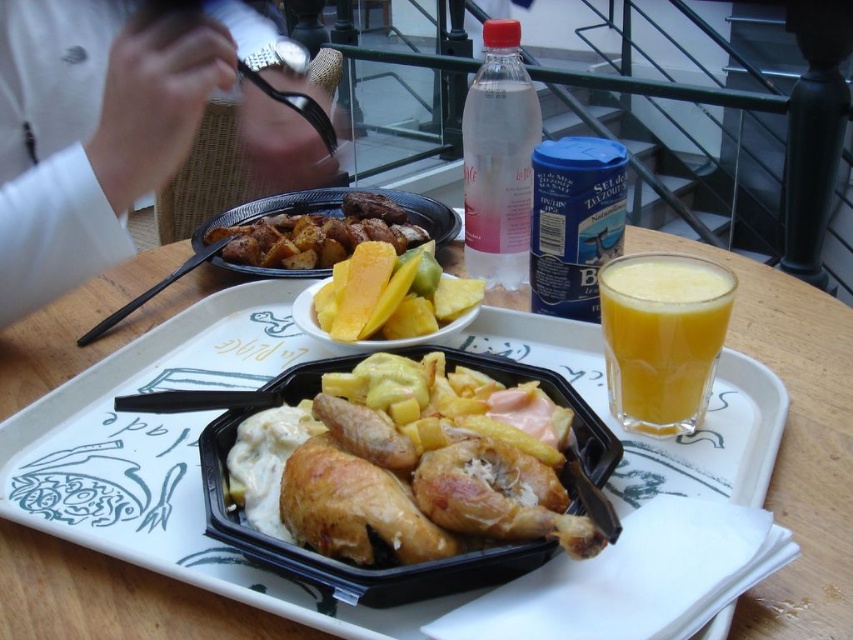
Question: Can you confirm if golden crispy chicken at center is wider than clear plastic bottle at upper center?

Choices:
 (A) no
 (B) yes

Answer: (B)

Question: Which object appears closest to the camera in this image?

Choices:
 (A) translucent glass cup at upper right
 (B) clear plastic bottle at upper center
 (C) yellow matte mangoes at center

Answer: (A)

Question: Which point is farther to the camera?

Choices:
 (A) (316, 250)
 (B) (341, 278)
 (C) (747, 486)
 (D) (720, 340)

Answer: (A)

Question: Is translucent glass cup at upper right to the right of clear plastic bottle at upper center from the viewer's perspective?

Choices:
 (A) yes
 (B) no

Answer: (A)

Question: Which object is positioned farthest from the yellow matte pineapple at center?

Choices:
 (A) clear plastic bottle at upper center
 (B) translucent glass cup at upper right

Answer: (B)

Question: Is golden crispy chicken at center thinner than yellow matte pineapple at center?

Choices:
 (A) yes
 (B) no

Answer: (A)